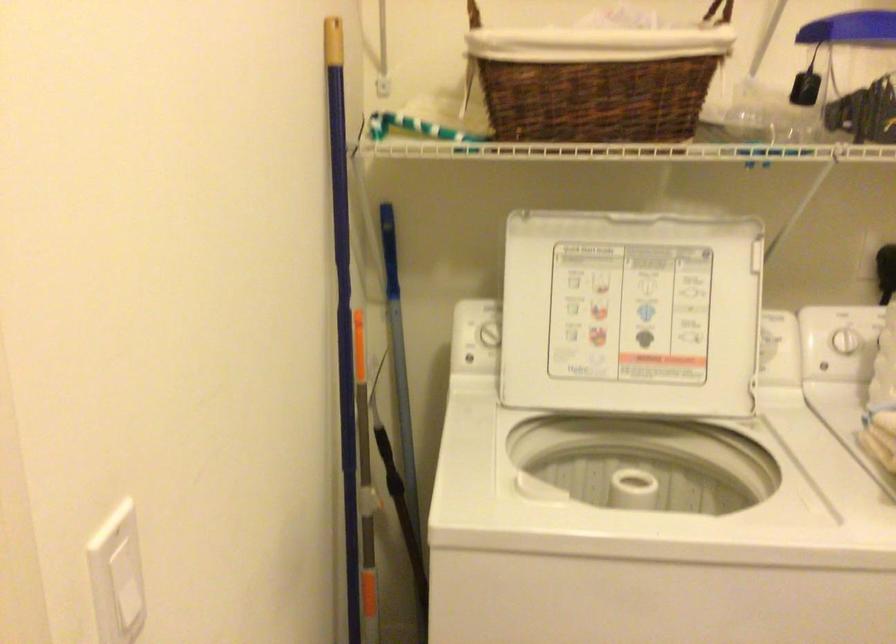
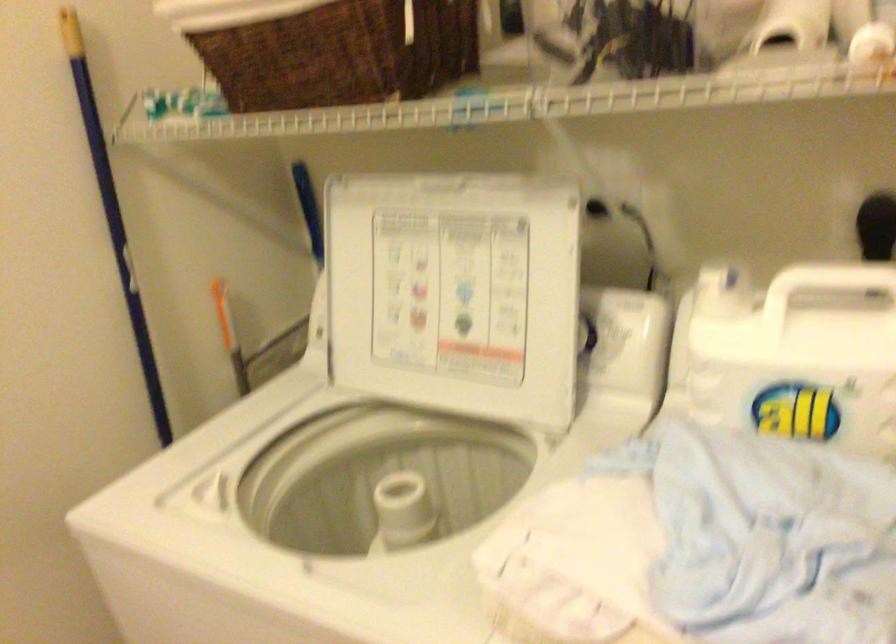
Question: I am providing you with two images of the same scene from different viewpoints. Please identify which objects are invisible in image2.

Choices:
 (A) yellow patterned pillow
 (B) blue pole
 (C) gray mop handle
 (D) brown wicker basket

Answer: (C)